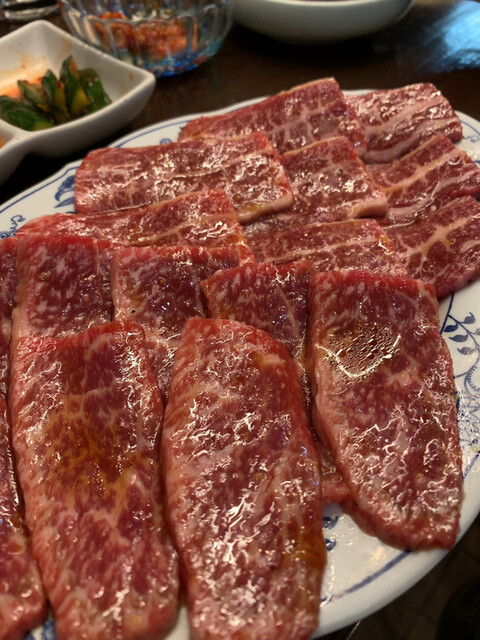
The height and width of the screenshot is (640, 480). I want to click on white segmented dish, so point(74,129).